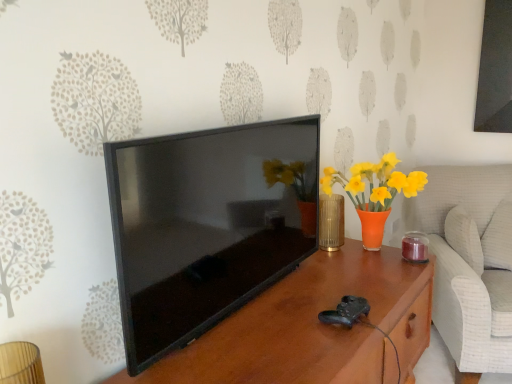
Measure the distance between brown wood table at center and camera.

brown wood table at center and camera are 1.00 meters apart from each other.

Measure the distance between point (338, 237) and camera.

They are 6.05 feet apart.

What is the approximate height of black glossy tv at center?

→ black glossy tv at center is 22.77 inches tall.

What do you see at coordinates (207, 225) in the screenshot? I see `black glossy tv at center` at bounding box center [207, 225].

Image resolution: width=512 pixels, height=384 pixels. In order to click on brown wood table at center in this screenshot , I will do `click(314, 327)`.

Which of these two, black glossy tv at center or brown wood table at center, stands taller?

brown wood table at center is taller.

Is point (247, 140) closer to camera compared to point (273, 355)?

No, it is behind (273, 355).

In the scene shown: Considering the sizes of objects black glossy tv at center and brown wood table at center in the image provided, who is wider, black glossy tv at center or brown wood table at center?

brown wood table at center.

Are black glossy tv at center and brown wood table at center beside each other?

They are not placed beside each other.

How many degrees apart are the facing directions of white textured swivel chair at right and brown wood table at center?

There is a 58.8-degree angle between the facing directions of white textured swivel chair at right and brown wood table at center.

Is point (460, 350) behind point (386, 261)?

Yes, point (460, 350) is farther from viewer.

Measure the distance from white textured swivel chair at right to brown wood table at center.

26.30 inches.

Is white textured swivel chair at right far from brown wood table at center?

No, white textured swivel chair at right is in close proximity to brown wood table at center.

Are black glossy tv at center and white textured swivel chair at right located far from each other?

That's right, there is a large distance between black glossy tv at center and white textured swivel chair at right.

From a real-world perspective, is black glossy tv at center under white textured swivel chair at right?

Incorrect, from a real-world perspective, black glossy tv at center is higher than white textured swivel chair at right.

Who is shorter, black glossy tv at center or white textured swivel chair at right?

With less height is black glossy tv at center.

You are a GUI agent. You are given a task and a screenshot of the screen. Output one action in this format:
    pyautogui.click(x=<x>, y=<y>)
    Task: Click on the television that is in front of the white textured swivel chair at right
    Image resolution: width=512 pixels, height=384 pixels.
    Given the screenshot: What is the action you would take?
    pyautogui.click(x=207, y=225)

Which of these two, gold textured vase at center or black glossy tv at center, is wider?

gold textured vase at center.

In the scene shown: From the image's perspective, does gold textured vase at center appear higher than black glossy tv at center?

Incorrect, from the image's perspective, gold textured vase at center is lower than black glossy tv at center.

Does point (325, 195) appear closer or farther from the camera than point (224, 159)?

Point (325, 195).

Can you tell me how much gold textured vase at center and black glossy tv at center differ in facing direction?

The facing directions of gold textured vase at center and black glossy tv at center are 169 degrees apart.

Considering the sizes of objects brown wood table at center and black glossy tv at center in the image provided, who is taller, brown wood table at center or black glossy tv at center?

Standing taller between the two is brown wood table at center.

Which of these two, brown wood table at center or black glossy tv at center, is smaller?

Smaller between the two is black glossy tv at center.

This screenshot has width=512, height=384. What are the coordinates of `television above the brown wood table at center (from the image's perspective)` in the screenshot? It's located at (207, 225).

Is brown wood table at center thinner than black glossy tv at center?

Incorrect, the width of brown wood table at center is not less than that of black glossy tv at center.

Between point (469, 168) and point (342, 238), which one is positioned behind?

The point (469, 168) is farther.

Does white textured swivel chair at right have a lesser width compared to gold textured vase at center?

No.

Which object is positioned more to the right, white textured swivel chair at right or gold textured vase at center?

white textured swivel chair at right is more to the right.

Between white textured swivel chair at right and gold textured vase at center, which one has more height?

white textured swivel chair at right.

Would you say gold textured vase at center contains brown wood table at center?

No, brown wood table at center is not surrounded by gold textured vase at center.

Could you tell me if gold textured vase at center is facing brown wood table at center?

No, gold textured vase at center does not turn towards brown wood table at center.

Considering the sizes of objects gold textured vase at center and brown wood table at center in the image provided, who is shorter, gold textured vase at center or brown wood table at center?

gold textured vase at center is shorter.

The height and width of the screenshot is (384, 512). Identify the location of vase located on the right of brown wood table at center. (331, 222).

Image resolution: width=512 pixels, height=384 pixels. What are the coordinates of `table located below the black glossy tv at center (from the image's perspective)` in the screenshot? It's located at (314, 327).

This screenshot has width=512, height=384. In order to click on table in front of the white textured swivel chair at right in this screenshot , I will do `click(314, 327)`.

When comparing their distances from white textured swivel chair at right, does brown wood table at center or black glossy tv at center seem further?

Based on the image, black glossy tv at center appears to be further to white textured swivel chair at right.

Considering their positions, is gold textured vase at center positioned further to white textured swivel chair at right than brown wood table at center?

Based on the image, gold textured vase at center appears to be further to white textured swivel chair at right.

Considering their positions, is gold textured vase at center positioned closer to black glossy tv at center than brown wood table at center?

brown wood table at center.

Considering their positions, is gold textured vase at center positioned closer to brown wood table at center than white textured swivel chair at right?

The object closer to brown wood table at center is gold textured vase at center.

Looking at the image, which one is located further to brown wood table at center, white textured swivel chair at right or black glossy tv at center?

white textured swivel chair at right is positioned further to the anchor brown wood table at center.

Which object lies nearer to the anchor point brown wood table at center, black glossy tv at center or gold textured vase at center?

black glossy tv at center is closer to brown wood table at center.

Looking at this image, when comparing their distances from black glossy tv at center, does white textured swivel chair at right or brown wood table at center seem closer?

brown wood table at center lies closer to black glossy tv at center than the other object.

Which object lies further to the anchor point gold textured vase at center, black glossy tv at center or brown wood table at center?

Based on the image, black glossy tv at center appears to be further to gold textured vase at center.

I want to click on television between brown wood table at center and gold textured vase at center from front to back, so click(x=207, y=225).

This screenshot has width=512, height=384. I want to click on vase between black glossy tv at center and white textured swivel chair at right, so click(x=331, y=222).

At what (x,y) coordinates should I click in order to perform the action: click on table between black glossy tv at center and white textured swivel chair at right from left to right. Please return your answer as a coordinate pair (x, y). The height and width of the screenshot is (384, 512). Looking at the image, I should click on (314, 327).

Find the location of a particular element. The image size is (512, 384). vase situated between brown wood table at center and white textured swivel chair at right from left to right is located at coordinates (331, 222).